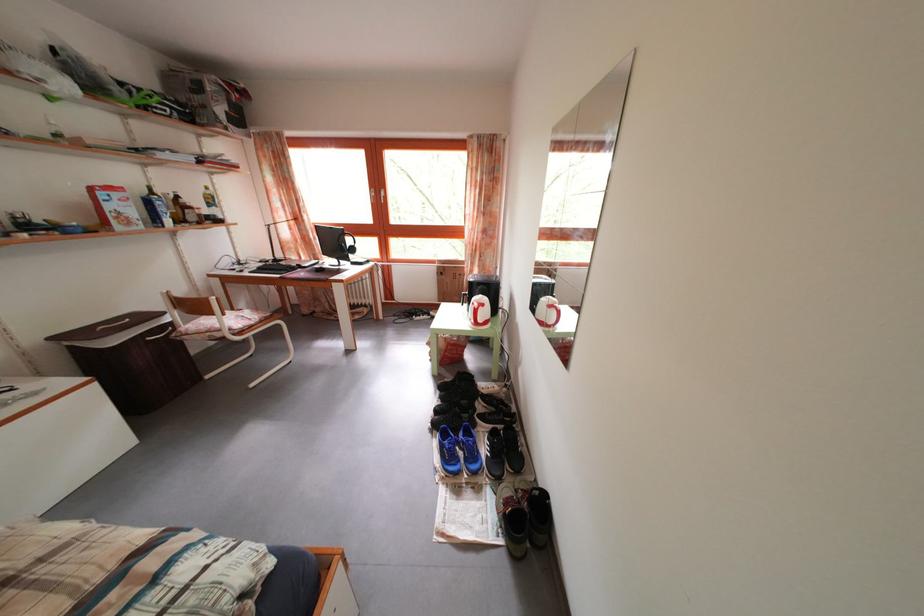
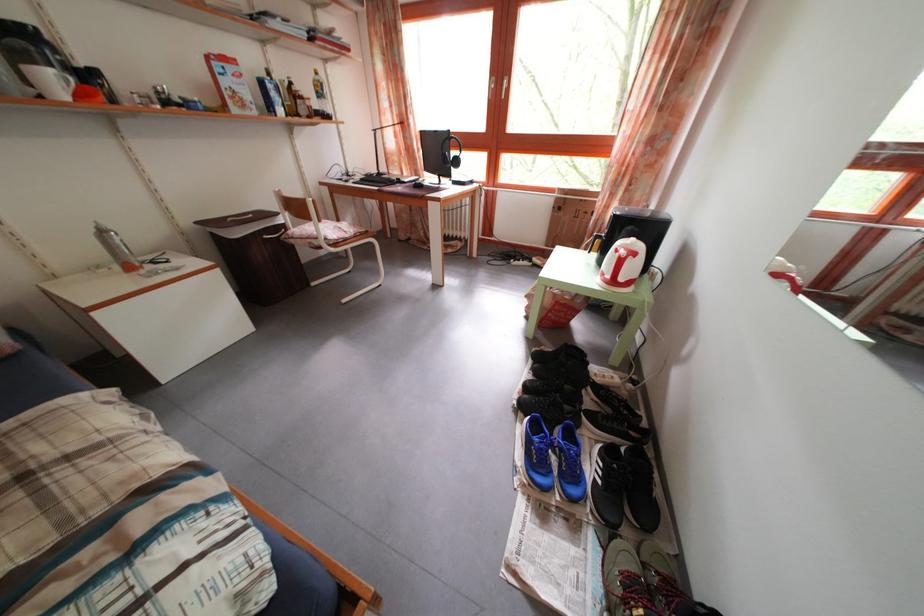
In the second image, find the point that corresponds to pixel 490 312 in the first image.

(641, 262)